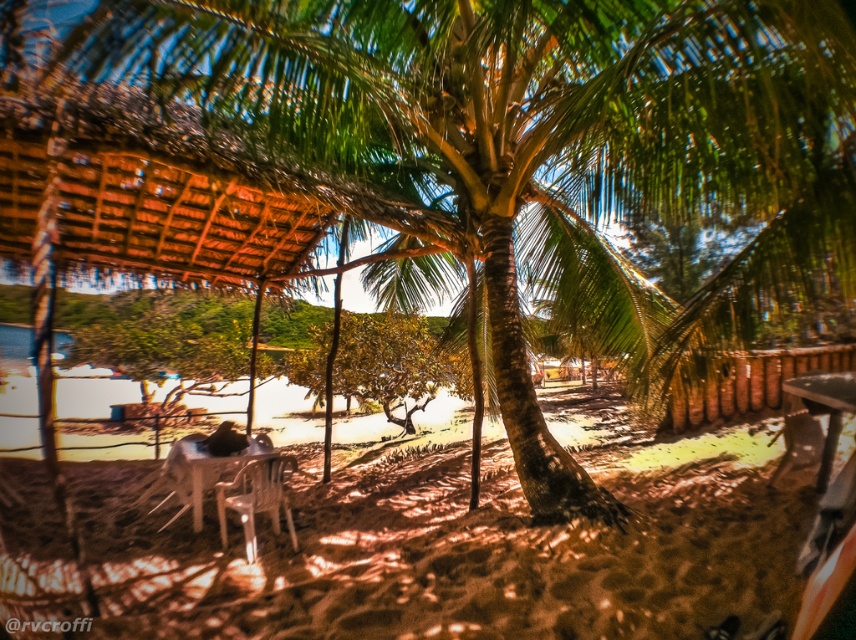
Does point (180, 154) lie behind point (205, 456)?

No.

Which is above, thatched brown roof at upper left or white plastic table at center?

thatched brown roof at upper left is above.

Locate an element on the screen. The width and height of the screenshot is (856, 640). thatched brown roof at upper left is located at coordinates (x=140, y=198).

Find the location of `thatched brown roof at upper left`. thatched brown roof at upper left is located at coordinates (140, 198).

Is point (34, 237) positioned behind point (854, 372)?

No.

Between thatched brown roof at upper left and metallic silver table at lower right, which one is positioned lower?

metallic silver table at lower right is below.

Image resolution: width=856 pixels, height=640 pixels. In order to click on thatched brown roof at upper left in this screenshot , I will do `click(140, 198)`.

The image size is (856, 640). Identify the location of thatched brown roof at upper left. (140, 198).

This screenshot has height=640, width=856. Describe the element at coordinates (429, 552) in the screenshot. I see `beige sand at center` at that location.

The width and height of the screenshot is (856, 640). Describe the element at coordinates (429, 552) in the screenshot. I see `beige sand at center` at that location.

The image size is (856, 640). I want to click on beige sand at center, so click(429, 552).